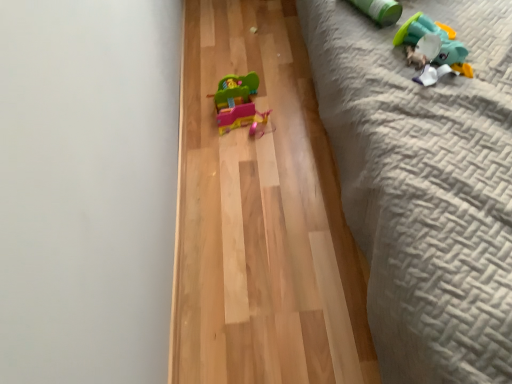
Where is `vacant space behind matte plastic toy at center, which ranks as the first toy in back-to-front order`? vacant space behind matte plastic toy at center, which ranks as the first toy in back-to-front order is located at coordinates (241, 65).